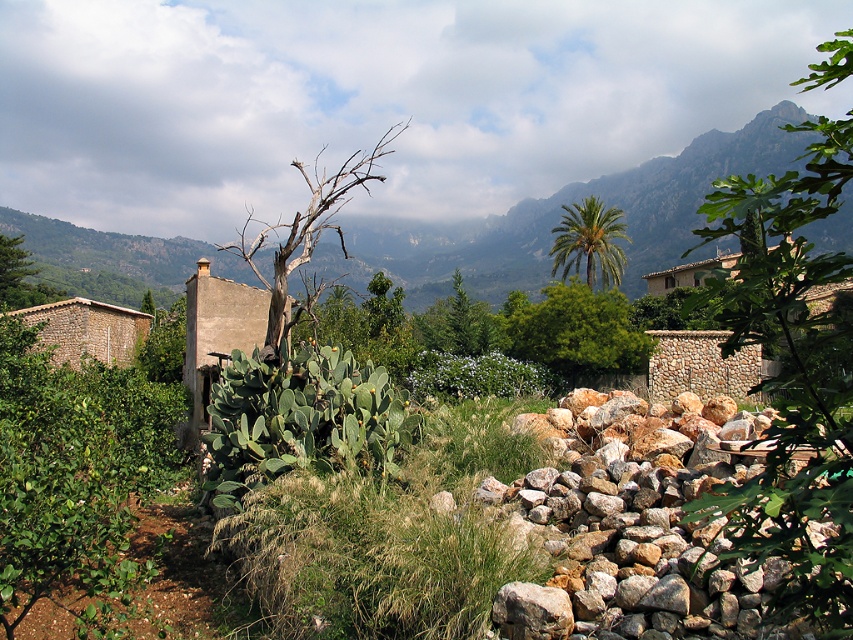
You are planning to take a photo of both the green leafy tree at right and the rocky mountain at upper center. Which object should you zoom in more on to ensure both are clearly visible in your photo?

Since the green leafy tree at right is larger than the rocky mountain at upper center, you should zoom in more on the green leafy tree at right to ensure both are clearly visible in your photo.

You are a hiker trying to determine which object in the scene is taller. You see the green leafy tree at right and the rocky mountain at upper center. Based on their positions, which one is taller?

The green leafy tree at right is taller than the rocky mountain at upper center according to the description.

You are standing in the rural landscape scene. There are two points marked in the image. The first point is at coordinates point [643,360] and the second is at point [602,225]. Which point is closer to you?

Point [643,360] is closer to the camera than point [602,225].